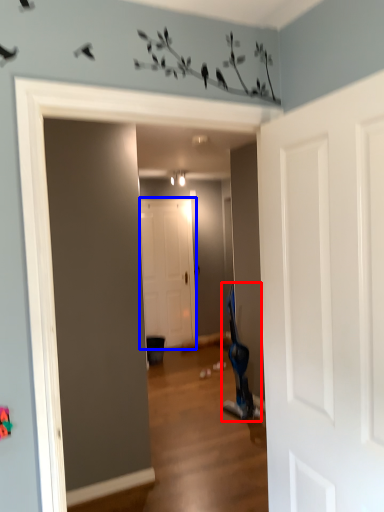
Question: Among these objects, which one is farthest to the camera, swivel chair (highlighted by a red box) or door (highlighted by a blue box)?

Choices:
 (A) swivel chair
 (B) door

Answer: (B)